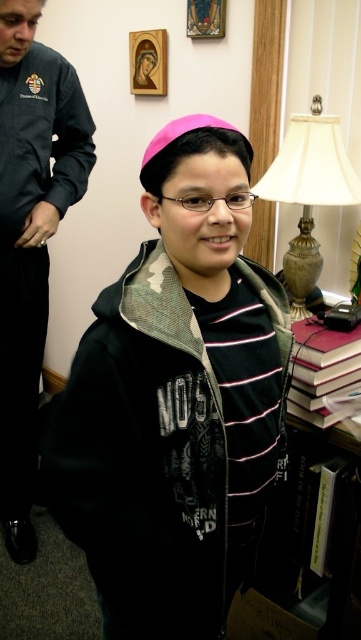
You are a photographer who needs to adjust the lighting to ensure both the dark gray jacket at left and the maroon leather book at lower right are well lit. Which object should you focus on first to avoid casting a shadow over the other?

The dark gray jacket at left is positioned over the maroon leather book at lower right, so focusing on lighting the jacket first would prevent its shadow from falling onto the book below.

You are an interior designer assessing the space for proper arrangement. Given the dark gray jacket at left and the maroon leather book at lower right, which object would you need to adjust if you want both items to be at the same height?

The maroon leather book at lower right needs to be raised since the dark gray jacket at left is taller. To make them the same height, adjust the maroon leather book at lower right upwards to match the height of the dark gray jacket at left.

You are a photographer standing at the camera position. You need to take a photo of the boy while ensuring the dark gray jacket at left does not appear in the frame. Is the jacket too close to the boy to avoid capturing it in the photo?

The dark gray jacket at left is 3.98 feet away from the camera. Since the jacket is positioned at the edge of the frame, it might still be visible unless the photographer adjusts the camera angle or moves closer to the boy to exclude the jacket from the shot.